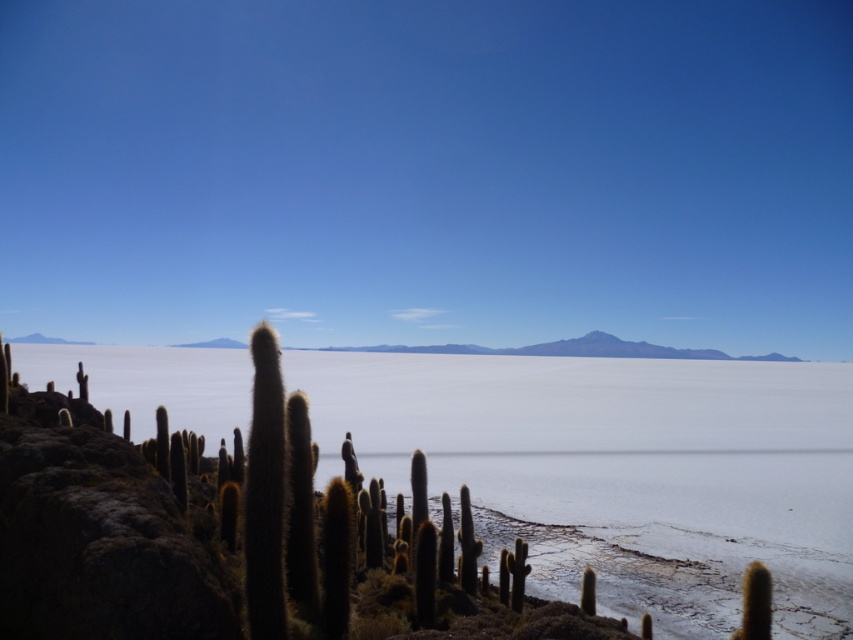
Which of these two, white matte water at center or white salt flat at center, stands taller?

white matte water at center

Between point (485, 538) and point (611, 355), which one is positioned behind?

The point (611, 355) is behind.

Identify the location of white matte water at center. (619, 472).

Identify the location of white matte water at center. The width and height of the screenshot is (853, 640). (619, 472).